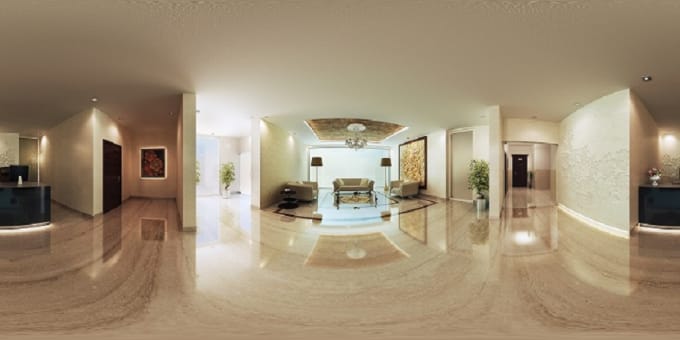
The height and width of the screenshot is (340, 680). Find the location of `area rug`. area rug is located at coordinates (354, 201).